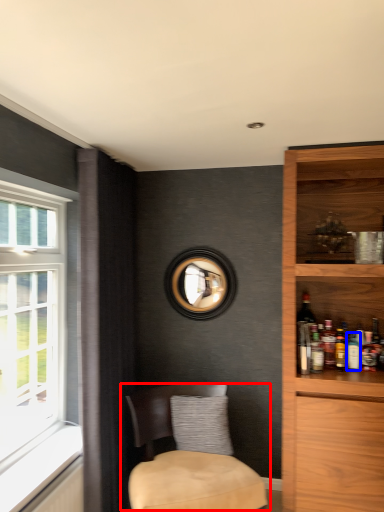
Question: Which object is closer to the camera taking this photo, chair (highlighted by a red box) or beverage (highlighted by a blue box)?

Choices:
 (A) chair
 (B) beverage

Answer: (A)